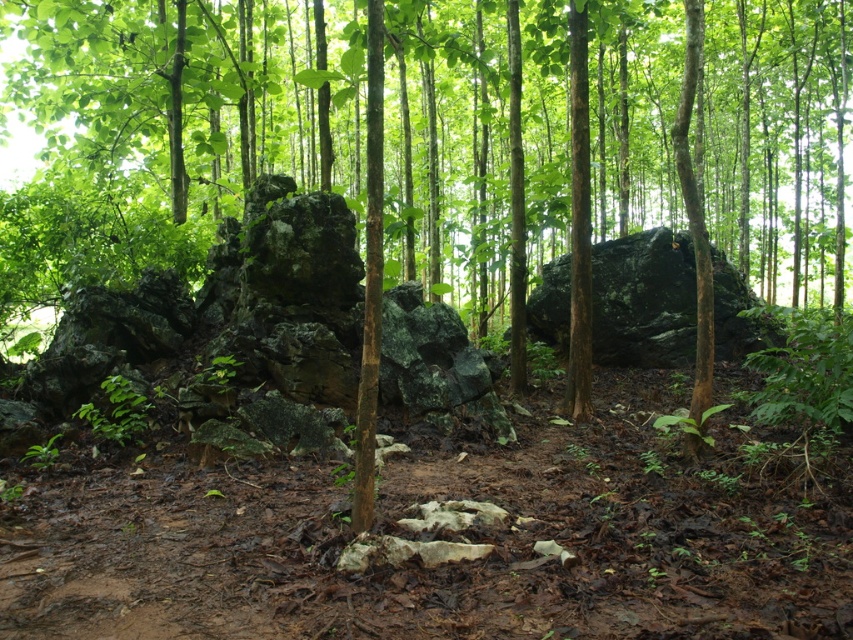
Question: Which object is farther from the camera taking this photo?

Choices:
 (A) dark gray rough rock at center
 (B) green rough bark tree at center

Answer: (A)

Question: Is green rough bark tree at center to the right of dark gray rough rock at center from the viewer's perspective?

Choices:
 (A) no
 (B) yes

Answer: (B)

Question: Is green rough bark tree at center further to the viewer compared to dark gray rough rock at center?

Choices:
 (A) yes
 (B) no

Answer: (B)

Question: Which point is closer to the camera?

Choices:
 (A) dark gray rough rock at center
 (B) green rough bark tree at center

Answer: (B)

Question: Does green rough bark tree at center have a greater width compared to dark gray rough rock at center?

Choices:
 (A) no
 (B) yes

Answer: (B)